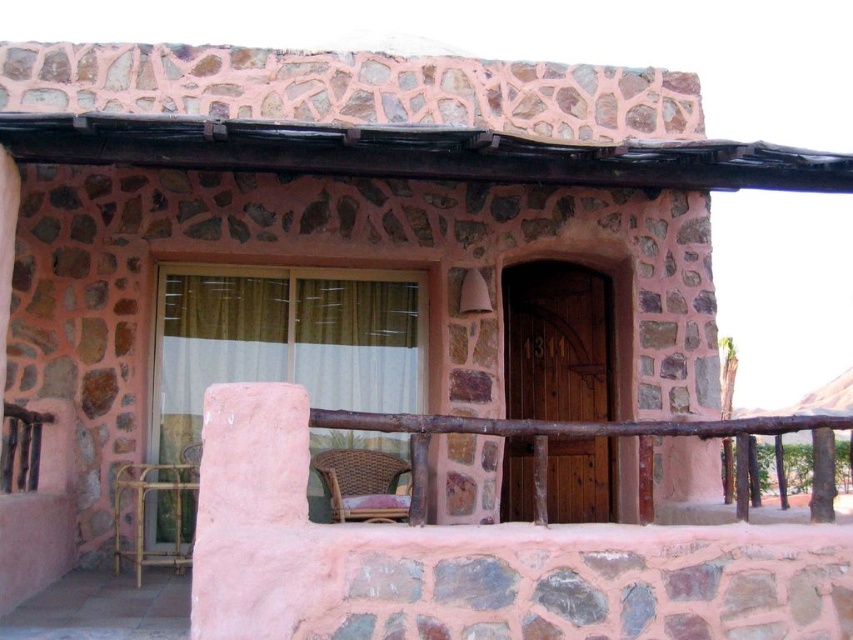
Is rattan chair at lower center below gold bamboo balustrade at lower left?

No.

Between rattan chair at lower center and gold bamboo balustrade at lower left, which one appears on the right side from the viewer's perspective?

Positioned to the right is rattan chair at lower center.

Is point (357, 467) closer to camera compared to point (137, 529)?

No, it is not.

This screenshot has width=853, height=640. Identify the location of rattan chair at lower center. (363, 484).